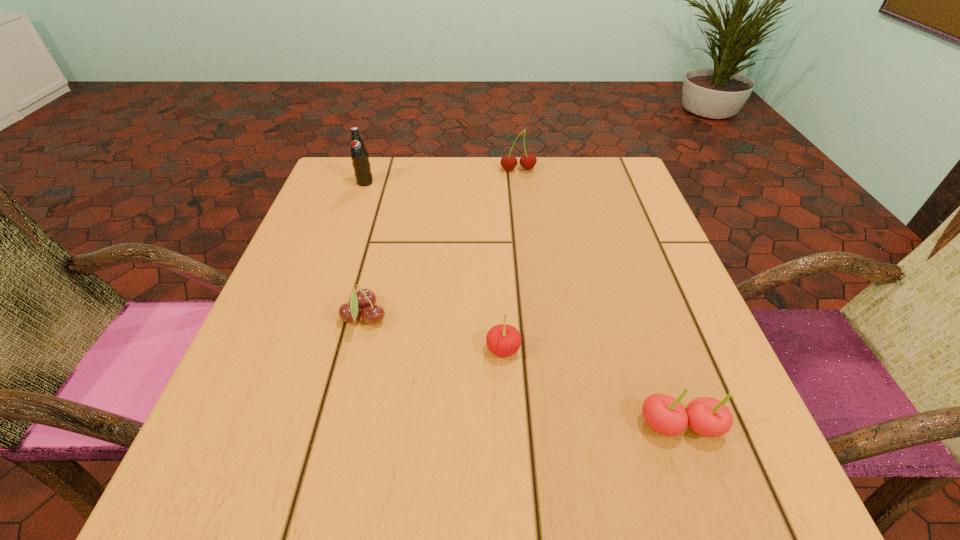
Locate an element on the screen. The width and height of the screenshot is (960, 540). vacant region between the second object from left to right and the nearest cherry is located at coordinates (522, 372).

The width and height of the screenshot is (960, 540). I want to click on object that stands as the third closest to the leftmost cherry, so click(x=706, y=416).

The image size is (960, 540). Find the location of `object that can be found as the second closest to the leftmost object`. object that can be found as the second closest to the leftmost object is located at coordinates (365, 299).

Select which cherry is the third closest to the farthest object. Please provide its 2D coordinates. Your answer should be formatted as a tuple, i.e. [(x, y)], where the tuple contains the x and y coordinates of a point satisfying the conditions above.

[(706, 416)]

Point out which cherry is positioned as the second nearest to the farthest object. Please provide its 2D coordinates. Your answer should be formatted as a tuple, i.e. [(x, y)], where the tuple contains the x and y coordinates of a point satisfying the conditions above.

[(503, 340)]

Find the location of a particular element. The width and height of the screenshot is (960, 540). free space that satisfies the following two spatial constraints: 1. on the surface of the farthest cherry; 2. on the leaves of the fourth object from right to left is located at coordinates (536, 318).

At what (x,y) coordinates should I click in order to perform the action: click on blank space that satisfies the following two spatial constraints: 1. on the surface of the rightmost object; 2. on the left side of the farthest object. Please return your answer as a coordinate pair (x, y). Looking at the image, I should click on (548, 426).

The image size is (960, 540). I want to click on vacant space that satisfies the following two spatial constraints: 1. on the surface of the nearest object; 2. on the right side of the farthest object, so click(548, 426).

Find the location of a particular element. The image size is (960, 540). vacant space that satisfies the following two spatial constraints: 1. on the surface of the farthest cherry; 2. on the left side of the rightmost cherry is located at coordinates (548, 426).